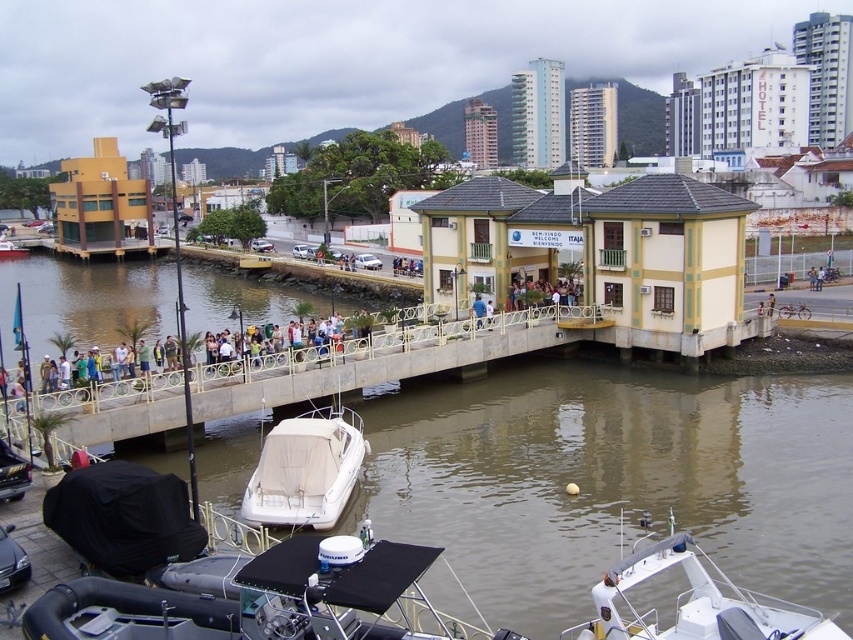
Question: Observing the image, what is the correct spatial positioning of brown murky water at center in reference to white matte boat at center?

Choices:
 (A) below
 (B) above

Answer: (A)

Question: In this image, where is white concrete dock at center located relative to beige canvas boat at center?

Choices:
 (A) below
 (B) above

Answer: (B)

Question: Which is farther from the beige canvas boat at center?

Choices:
 (A) white matte boat at center
 (B) brown murky water at center

Answer: (A)

Question: Does white matte boat at lower right have a smaller size compared to beige canvas boat at center?

Choices:
 (A) no
 (B) yes

Answer: (B)

Question: Which of the following is the farthest from the observer?

Choices:
 (A) white matte boat at lower right
 (B) white matte boat at center
 (C) white concrete dock at center
 (D) brown murky water at center

Answer: (B)

Question: Which of these objects is positioned closest to the white matte boat at center?

Choices:
 (A) brown murky water at center
 (B) white concrete dock at center
 (C) beige canvas boat at center

Answer: (B)